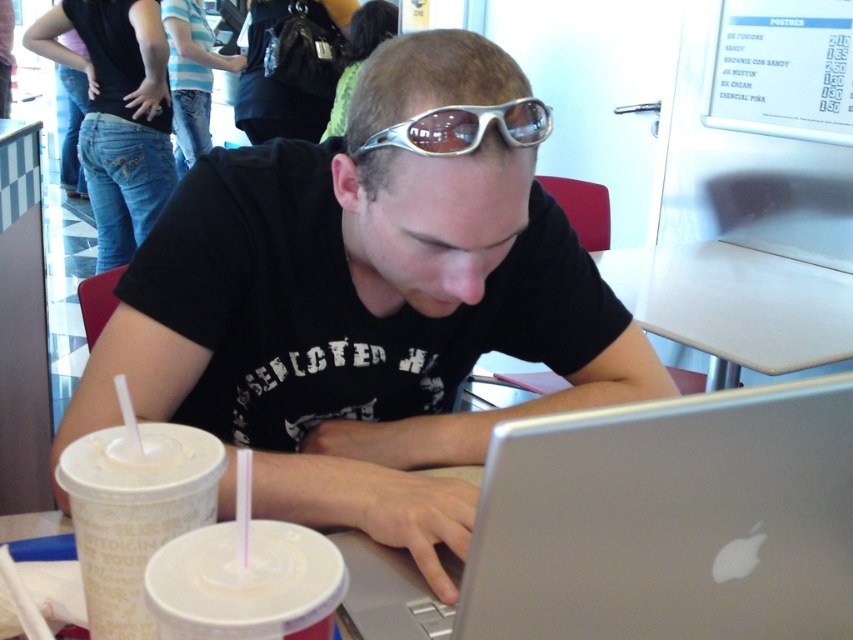
Is silver metallic laptop at center positioned at the back of white plastic table at center?

No, it is not.

Between silver metallic laptop at center and white plastic table at center, which one has less height?

silver metallic laptop at center is shorter.

Which is in front, point (757, 554) or point (670, 289)?

Point (757, 554) is more forward.

Where is `silver metallic laptop at center`? Image resolution: width=853 pixels, height=640 pixels. silver metallic laptop at center is located at coordinates (646, 528).

Between point (343, 513) and point (189, 532), which one is positioned behind?

The point (343, 513) is behind.

Does black matte shirt at center have a greater height compared to white matte cup at lower center?

Correct, black matte shirt at center is much taller as white matte cup at lower center.

Find the location of a particular element. black matte shirt at center is located at coordinates (363, 308).

Locate an element on the screen. Image resolution: width=853 pixels, height=640 pixels. black matte shirt at center is located at coordinates (363, 308).

Between white frosted cup at lower left and white matte cup at lower center, which one has less height?

white matte cup at lower center is shorter.

Find the location of a particular element. Image resolution: width=853 pixels, height=640 pixels. white frosted cup at lower left is located at coordinates (134, 513).